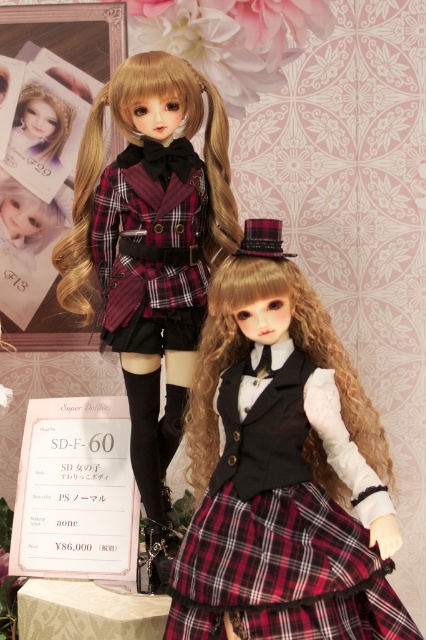
You are standing in front of the plaid fabric dress at center and want to reach it without moving your feet. Can you touch it with your outstretched hand if your arm can extend 3 feet?

The plaid fabric dress at center and viewer are 3.75 feet apart from each other. Since your arm can only extend 3 feet, you cannot reach the plaid fabric dress at center without moving your feet.

You are standing in front of the dolls and want to touch the point at coordinates point (60,259). Considering your arm can reach up to 3 feet, can you reach it without moving closer?

The point (60,259) is 5.05 feet away from the viewer, which is beyond the arm reach of 3 feet. You cannot reach it without moving closer.

You are a toy organizer who needs to place the matte black doll at upper left and the black plaid kilt at center into a display case that is 8 inches wide. Can both items fit side by side without overlapping?

The matte black doll at upper left is 7.31 inches away from the black plaid kilt at center, so they can fit side by side in the 8 inch wide display case as the total distance between them is less than the case width.